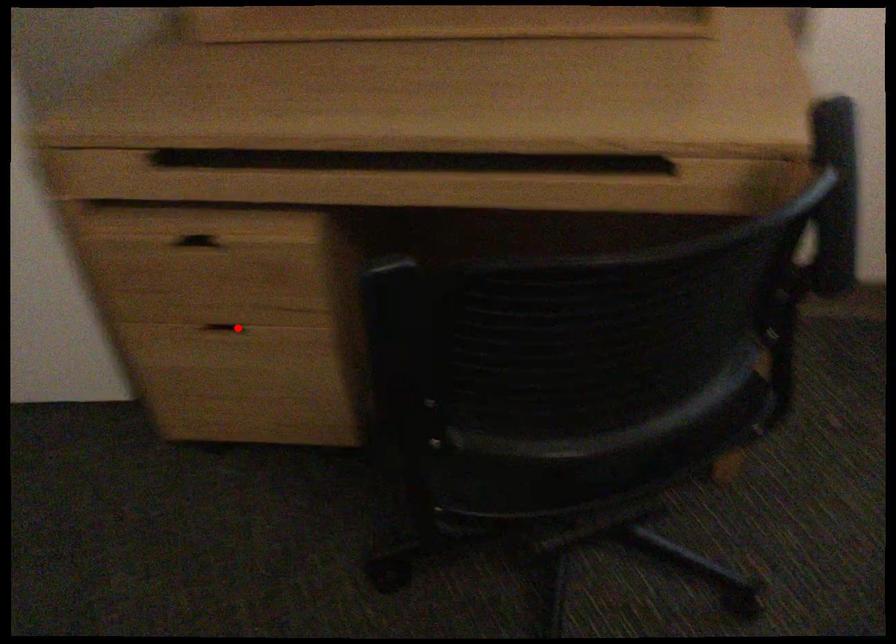
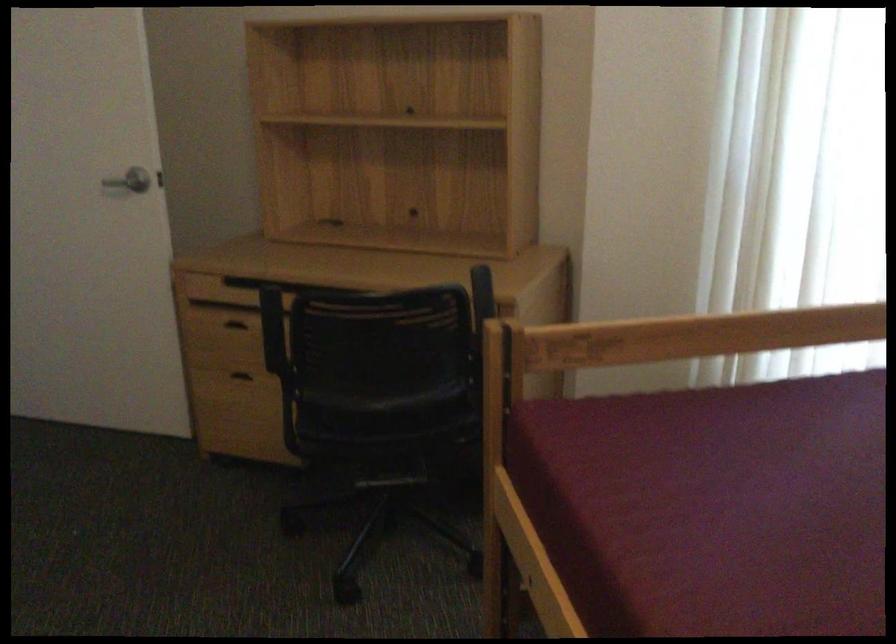
In the second image, find the point that corresponds to the highlighted location in the first image.

(246, 374)